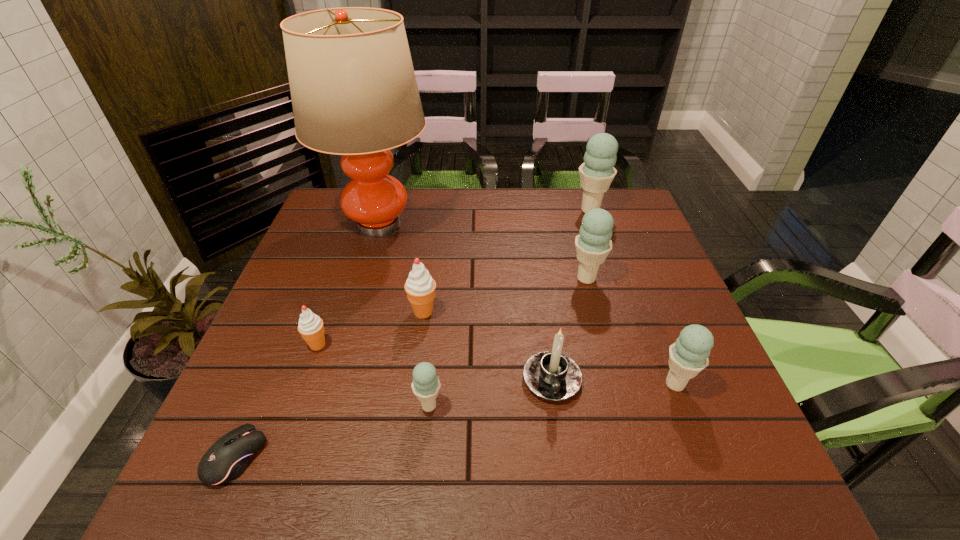
I want to click on orange lamp, so click(354, 93).

This screenshot has height=540, width=960. Find the location of `the tallest object`. the tallest object is located at coordinates (354, 93).

You are a GUI agent. You are given a task and a screenshot of the screen. Output one action in this format:
    pyautogui.click(x=<x>, y=<y>)
    Task: Click on the biggest blue ice cream
    The width and height of the screenshot is (960, 540).
    Given the screenshot: What is the action you would take?
    pyautogui.click(x=597, y=172)

Find the location of a particular element. The height and width of the screenshot is (540, 960). the tallest ice cream is located at coordinates 597,172.

The width and height of the screenshot is (960, 540). Find the location of `the second farthest ice cream`. the second farthest ice cream is located at coordinates (593, 244).

Identify the location of the seventh shortest object. pyautogui.click(x=593, y=244).

Where is `the right red icecream`? This screenshot has height=540, width=960. the right red icecream is located at coordinates (420, 287).

You are a GUI agent. You are given a task and a screenshot of the screen. Output one action in this format:
    pyautogui.click(x=<x>, y=<y>)
    Task: Click on the bigger red icecream
    The height and width of the screenshot is (540, 960).
    Given the screenshot: What is the action you would take?
    (420, 287)

You are a GUI agent. You are given a task and a screenshot of the screen. Output one action in this format:
    pyautogui.click(x=<x>, y=<y>)
    Task: Click on the third biggest blue ice cream
    This screenshot has height=540, width=960.
    Given the screenshot: What is the action you would take?
    pyautogui.click(x=688, y=356)

Identify the location of candle holder. (553, 376).